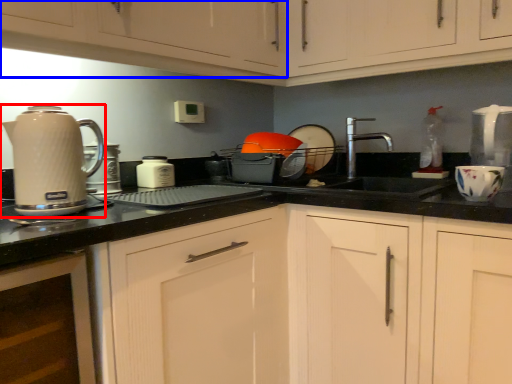
Question: Among these objects, which one is nearest to the camera, home appliance (highlighted by a red box) or cabinetry (highlighted by a blue box)?

Choices:
 (A) home appliance
 (B) cabinetry

Answer: (B)